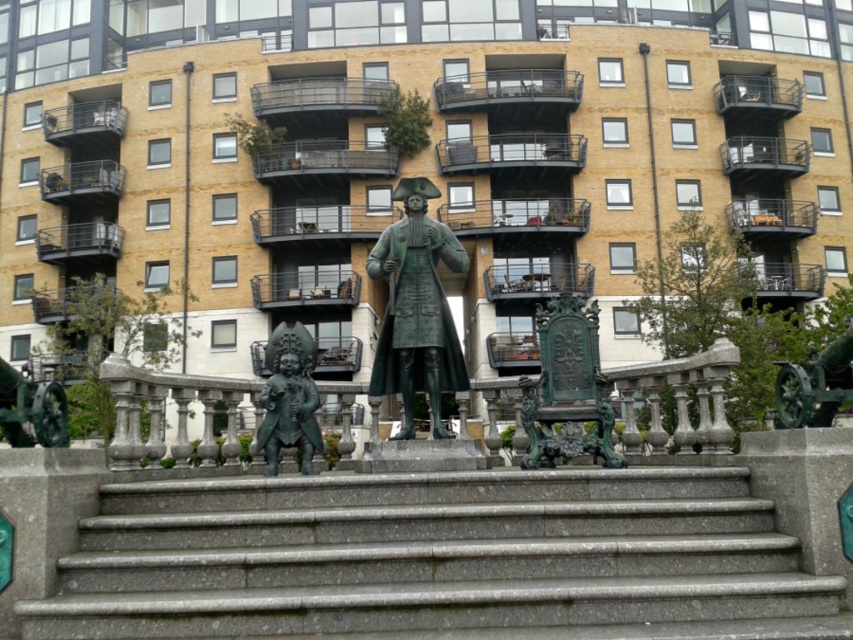
Which is behind, point (421, 365) or point (570, 406)?

The point (421, 365) is behind.

Is point (421, 275) positioned before point (532, 408)?

No, it is behind (532, 408).

Where is `green patinated bronze statue at center`? The height and width of the screenshot is (640, 853). green patinated bronze statue at center is located at coordinates (416, 307).

In the scene shown: Does gray granite stairs at center appear over bronze statue at lower left?

Yes, gray granite stairs at center is above bronze statue at lower left.

This screenshot has width=853, height=640. What are the coordinates of `gray granite stairs at center` in the screenshot? It's located at (439, 557).

Can you confirm if green patinated bronze at center is shorter than bronze statue at lower left?

Correct, green patinated bronze at center is not as tall as bronze statue at lower left.

Does point (577, 352) lie behind point (270, 417)?

That is True.

Identify the location of green patinated bronze at center. The image size is (853, 640). (567, 388).